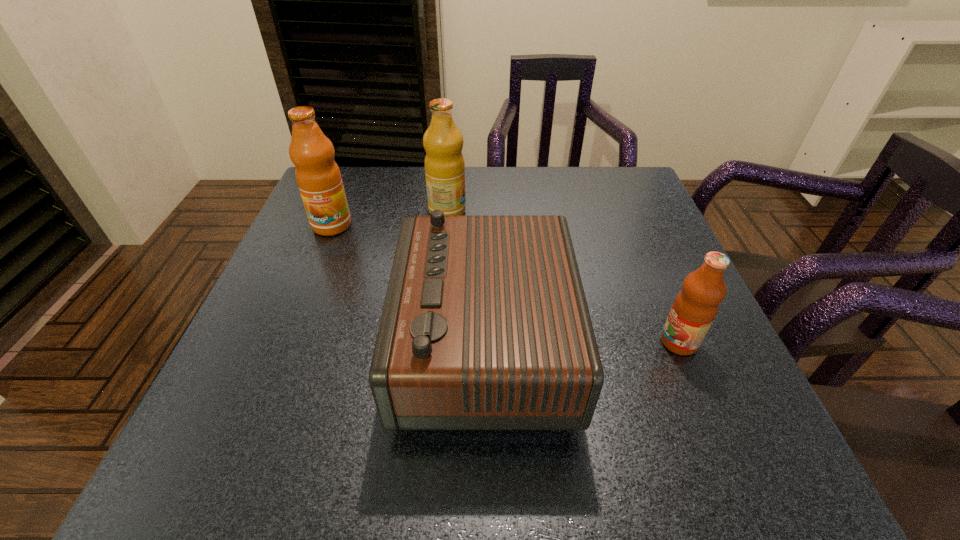
You are a GUI agent. You are given a task and a screenshot of the screen. Output one action in this format:
    pyautogui.click(x=<x>, y=<y>)
    Task: Click on the free space at the right edge of the desktop
    The width and height of the screenshot is (960, 540).
    Given the screenshot: What is the action you would take?
    coord(623,218)

Identify the location of free space at the far left corner of the desktop. The height and width of the screenshot is (540, 960). [x=370, y=188].

Where is `vacant region at the near left corner of the desktop`? Image resolution: width=960 pixels, height=540 pixels. vacant region at the near left corner of the desktop is located at coordinates (221, 480).

At what (x,y) coordinates should I click in order to perform the action: click on free area in between the second fruit juice from right to left and the leftmost object. Please return your answer as a coordinate pair (x, y). The width and height of the screenshot is (960, 540). Looking at the image, I should click on (390, 218).

I want to click on vacant space in between the second fruit juice from right to left and the leftmost fruit juice, so click(x=390, y=218).

I want to click on free space that is in between the second fruit juice from right to left and the leftmost fruit juice, so click(390, 218).

This screenshot has height=540, width=960. Find the location of `free space between the second fruit juice from right to left and the leftmost fruit juice`. free space between the second fruit juice from right to left and the leftmost fruit juice is located at coordinates (390, 218).

Identify the location of the second closest object to the nearest fruit juice. This screenshot has height=540, width=960. (444, 163).

Identify which object is located as the second nearest to the second fruit juice from left to right. Please provide its 2D coordinates. Your answer should be formatted as a tuple, i.e. [(x, y)], where the tuple contains the x and y coordinates of a point satisfying the conditions above.

[(319, 180)]

Identify the location of fruit juice that can be found as the closest to the rightmost fruit juice. The width and height of the screenshot is (960, 540). (444, 163).